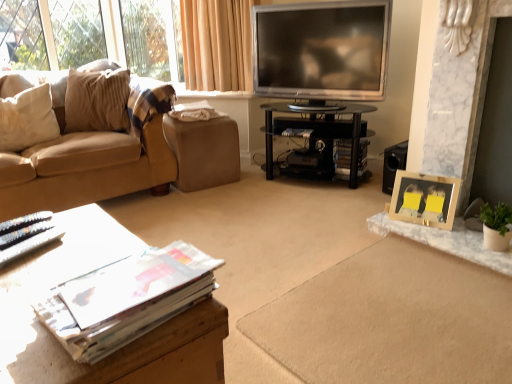
You are a GUI agent. You are given a task and a screenshot of the screen. Output one action in this format:
    pyautogui.click(x=<x>, y=<y>)
    Task: Click on the free space in front of white glossy magazine at lower left, arranged as the 3th magazine when viewed from the back
    The width and height of the screenshot is (512, 384).
    Given the screenshot: What is the action you would take?
    pyautogui.click(x=30, y=267)